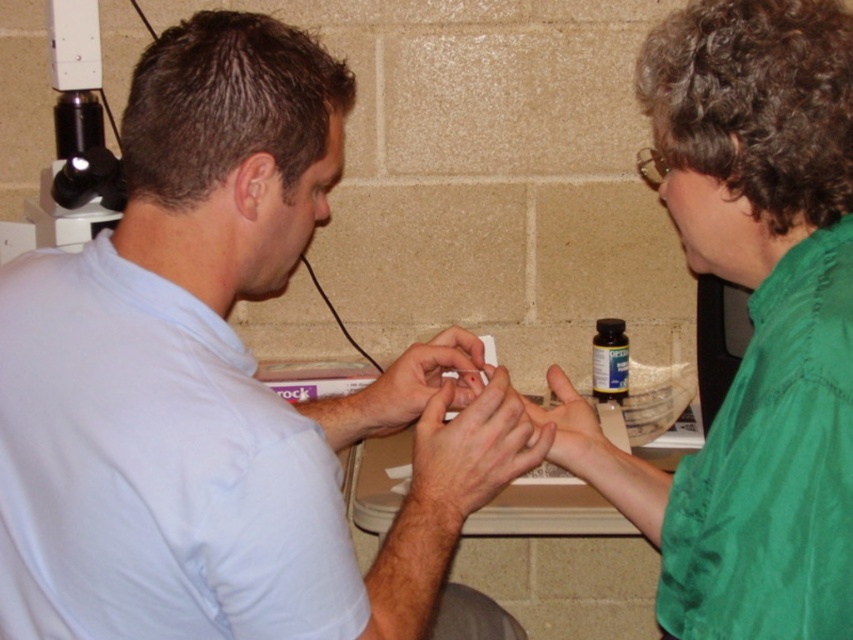
Does green satin shirt at upper right appear under matte white hands at center?

Actually, green satin shirt at upper right is above matte white hands at center.

Who is more distant from viewer, (834, 230) or (396, 362)?

The point (396, 362) is more distant.

Where is `green satin shirt at upper right`? This screenshot has height=640, width=853. green satin shirt at upper right is located at coordinates (758, 317).

Does point (200, 436) come closer to viewer compared to point (762, 550)?

No, (200, 436) is further to viewer.

Between point (256, 285) and point (676, 28), which one is positioned behind?

The point (256, 285) is behind.

This screenshot has height=640, width=853. In order to click on light blue shirt at center in this screenshot , I will do `click(216, 387)`.

Does matte white hands at center have a lesser width compared to green matte hand at center?

No, matte white hands at center is not thinner than green matte hand at center.

How much distance is there between matte white hands at center and green matte hand at center?

matte white hands at center and green matte hand at center are 5.29 inches apart from each other.

Which is behind, point (363, 428) or point (531, 417)?

Point (363, 428)

At what (x,y) coordinates should I click in order to perform the action: click on matte white hands at center. Please return your answer as a coordinate pair (x, y). This screenshot has height=640, width=853. Looking at the image, I should click on (421, 381).